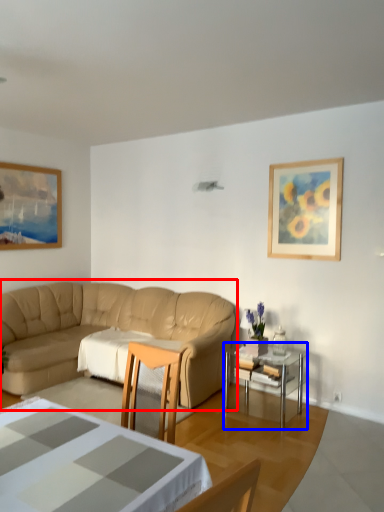
Question: Which object is further to the camera taking this photo, studio couch (highlighted by a red box) or table (highlighted by a blue box)?

Choices:
 (A) studio couch
 (B) table

Answer: (B)